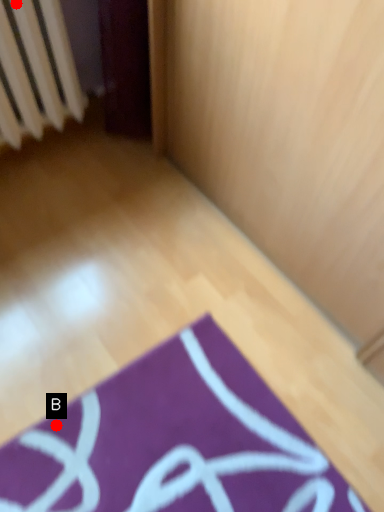
Question: Two points are circled on the image, labeled by A and B beside each circle. Which point is farther from the camera taking this photo?

Choices:
 (A) A is further
 (B) B is further

Answer: (A)